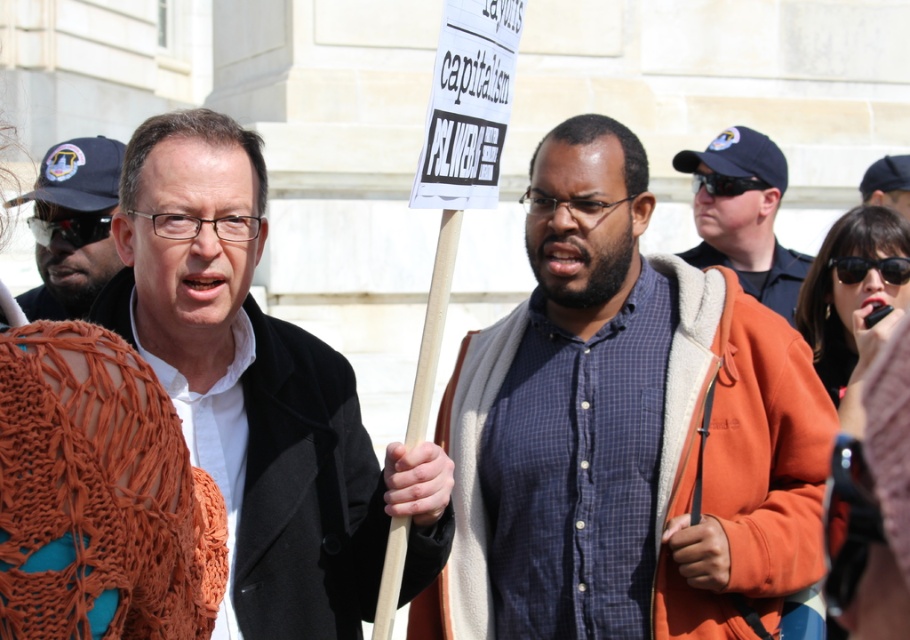
Question: Is matte black coat at center below matte black sunglasses at left?

Choices:
 (A) yes
 (B) no

Answer: (A)

Question: Which of the following is the farthest from the observer?

Choices:
 (A) blue plaid shirt at center
 (B) matte black coat at center
 (C) matte black sunglasses at left

Answer: (C)

Question: Which object appears farthest from the camera in this image?

Choices:
 (A) dark brown hair at center
 (B) matte black sunglasses at left

Answer: (A)

Question: Is matte black coat at center to the left of dark brown hair at center from the viewer's perspective?

Choices:
 (A) yes
 (B) no

Answer: (A)

Question: Which object is the farthest from the matte black sunglasses at left?

Choices:
 (A) blue plaid shirt at center
 (B) dark brown hair at center
 (C) matte black coat at center

Answer: (B)

Question: Considering the relative positions of blue plaid shirt at center and blue uniform at center in the image provided, where is blue plaid shirt at center located with respect to blue uniform at center?

Choices:
 (A) left
 (B) right

Answer: (A)